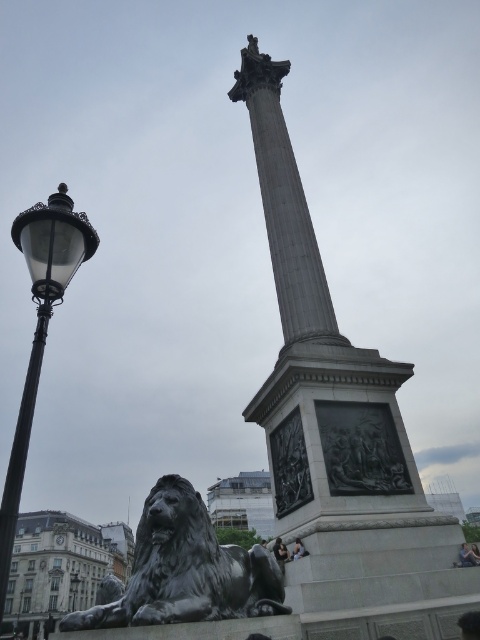
Question: Which point appears farthest from the camera in this image?

Choices:
 (A) (36, 333)
 (B) (462, 547)
 (C) (297, 557)
 (D) (205, 520)

Answer: (B)

Question: Is the position of black metal/texture lamp post at left more distant than that of dark hair at lower center?

Choices:
 (A) no
 (B) yes

Answer: (A)

Question: Which of the following is the farthest from the observer?

Choices:
 (A) gray stone column at center
 (B) polished bronze lion at lower left
 (C) dark hair at lower center
 (D) dark gray stone lion at lower left

Answer: (D)

Question: Does black metal/texture lamp post at left have a larger size compared to light brown leather jacket at lower right?

Choices:
 (A) no
 (B) yes

Answer: (B)

Question: Is polished bronze lion at lower left below dark hair at lower center?

Choices:
 (A) yes
 (B) no

Answer: (A)

Question: Among these objects, which one is nearest to the camera?

Choices:
 (A) gray stone column at center
 (B) dark hair at lower center

Answer: (A)